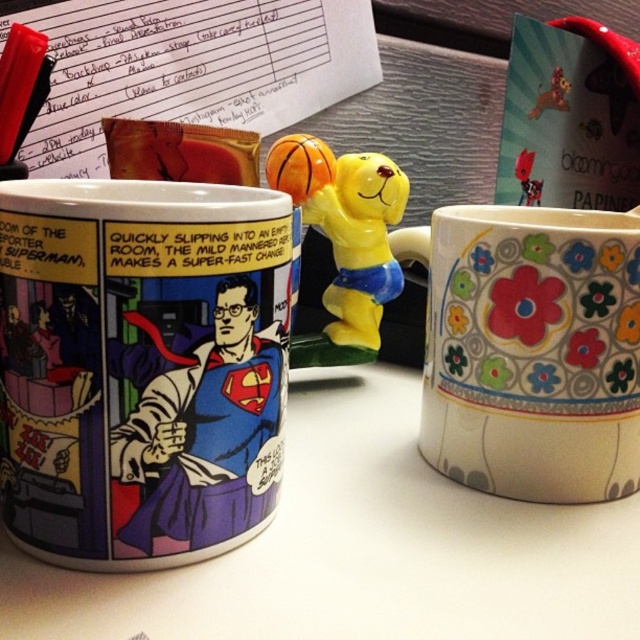
You are a person with a 20 cm long ruler. You want to measure the distance between yourself and the comic book print mug at center. Can you reach it with your ruler?

The comic book print mug at center is 36.20 centimeters away from viewer. The ruler is only 20 cm long, so you cannot reach it with your ruler.

You are a barista who needs to place a new coffee order on the desk. The customer specified they want their drink in the mug that is farther from the center of the desk. Which mug should you choose between the comic book print mug at center and the floral ceramic mug at right?

The floral ceramic mug at right is farther from the center of the desk than the comic book print mug at center, so you should choose the floral ceramic mug at right.

You are organizing a desk and need to place both the superman comic at center and the black plastic pen at upper left into a drawer. The drawer has a height limit of 10 cm. Can both items fit vertically without bending or damaging them?

The superman comic at center is larger than the black plastic pen at upper left. Since the drawer has a height limit of 10 cm, the superman comic at center may exceed this height, making it difficult to fit without bending or damaging it. The pen should fit easily, but the comic might not.